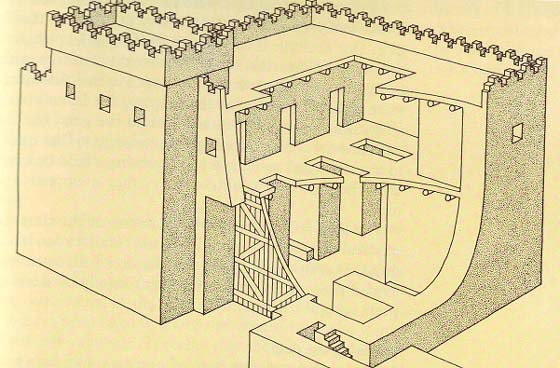
This screenshot has width=560, height=368. Identify the location of window. (70, 93), (102, 103), (138, 113), (211, 148), (518, 135).